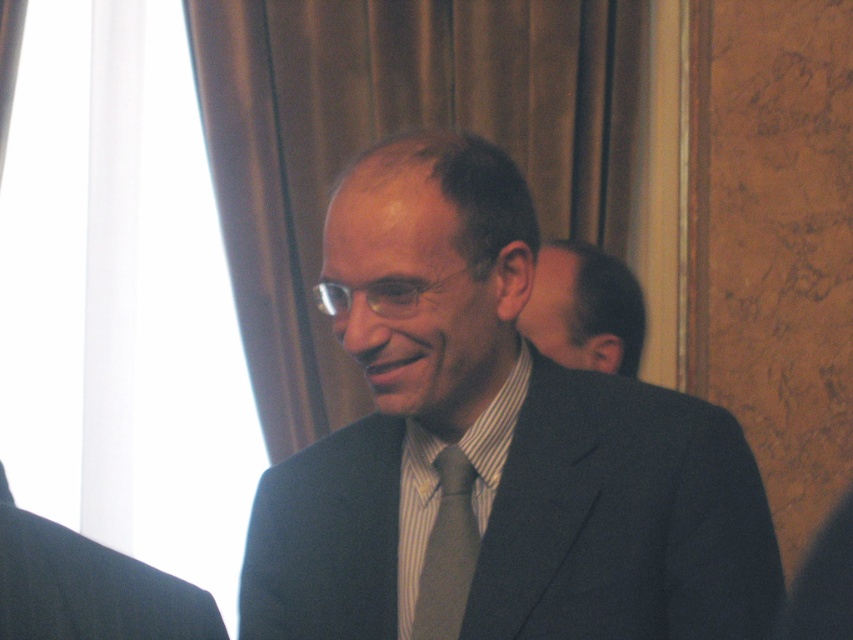
Find the location of `dark gray suit at center`. dark gray suit at center is located at coordinates (492, 449).

You are a GUI agent. You are given a task and a screenshot of the screen. Output one action in this format:
    pyautogui.click(x=<x>, y=<y>)
    Task: Click on the dark gray suit at center
    This screenshot has height=640, width=853.
    Given the screenshot: What is the action you would take?
    pyautogui.click(x=492, y=449)

The height and width of the screenshot is (640, 853). Find the location of `brown fabric curtain at left`. brown fabric curtain at left is located at coordinates (389, 136).

Based on the photo, does brown fabric curtain at left appear over smooth black hair at right?

Indeed, brown fabric curtain at left is positioned over smooth black hair at right.

Does point (380, 52) come in front of point (578, 273)?

No, (380, 52) is further to viewer.

Image resolution: width=853 pixels, height=640 pixels. In order to click on brown fabric curtain at left in this screenshot , I will do `click(389, 136)`.

Between brown fabric curtain at left and dark gray wool suit at left, which one appears on the right side from the viewer's perspective?

Positioned to the right is brown fabric curtain at left.

Does point (300, 324) lie behind point (96, 573)?

That is True.

Is point (283, 356) positioned behind point (165, 579)?

That is True.

Image resolution: width=853 pixels, height=640 pixels. I want to click on brown fabric curtain at left, so 389,136.